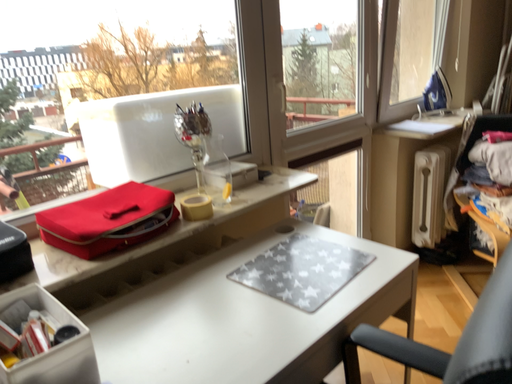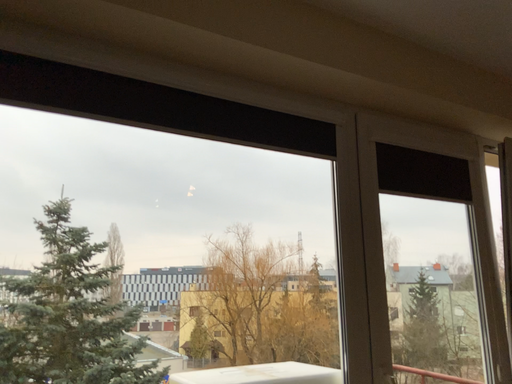
Question: How did the camera likely rotate when shooting the video?

Choices:
 (A) rotated right
 (B) rotated left

Answer: (B)